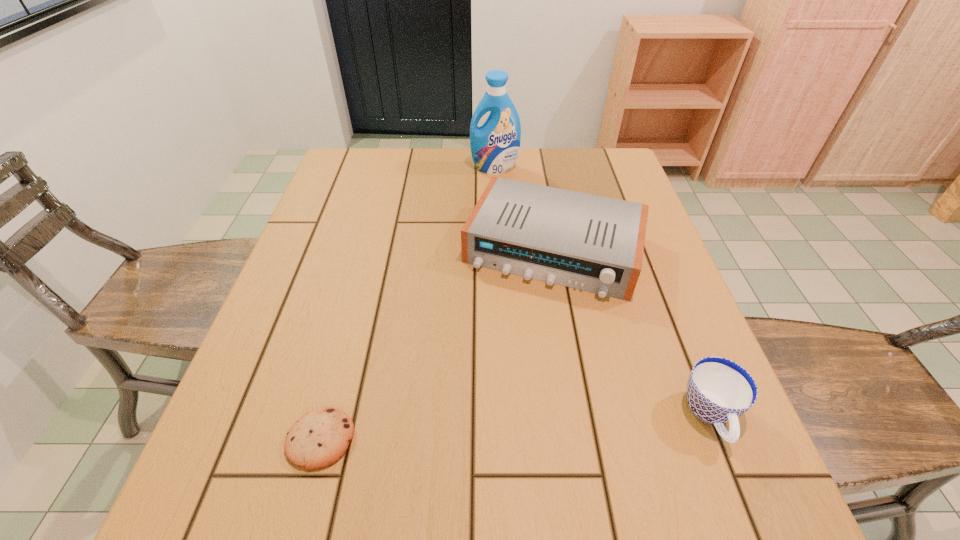
The width and height of the screenshot is (960, 540). I want to click on object that is at the near left corner, so coord(317,440).

I want to click on object present at the near right corner, so click(719, 390).

Find the location of a particular element. The width and height of the screenshot is (960, 540). blank space at the far edge of the desktop is located at coordinates (428, 164).

The height and width of the screenshot is (540, 960). What are the coordinates of `blank space at the left edge of the desktop` in the screenshot? It's located at (280, 307).

Locate an element on the screen. Image resolution: width=960 pixels, height=540 pixels. vacant region at the right edge of the desktop is located at coordinates (673, 289).

At what (x,y) coordinates should I click in order to perform the action: click on vacant space at the far left corner of the desktop. Please return your answer as a coordinate pair (x, y). This screenshot has height=540, width=960. Looking at the image, I should click on (347, 150).

Where is `free space at the near left corner of the desktop`? free space at the near left corner of the desktop is located at coordinates (252, 452).

Identify the location of vacant position at the far right corner of the desktop. (617, 181).

This screenshot has height=540, width=960. Find the location of `blank region between the radio receiver and the cup`. blank region between the radio receiver and the cup is located at coordinates (632, 332).

Identify the location of vacant area between the detergent and the shortest object. Image resolution: width=960 pixels, height=540 pixels. click(x=408, y=303).